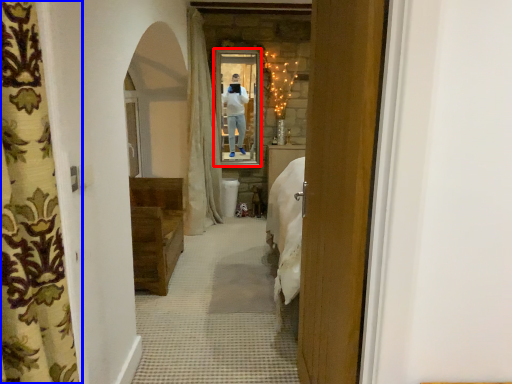
Question: Among these objects, which one is farthest to the camera, mirror (highlighted by a red box) or curtain (highlighted by a blue box)?

Choices:
 (A) mirror
 (B) curtain

Answer: (A)